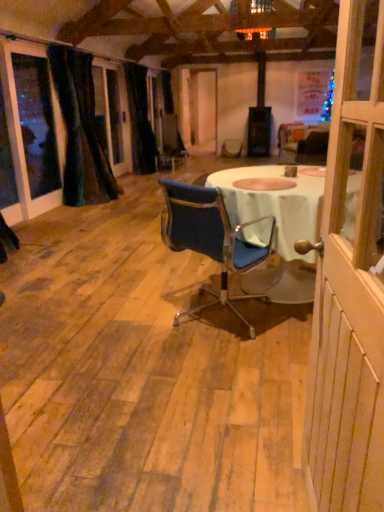
Consider the image. Measure the distance between blue fabric chair at center and camera.

The depth of blue fabric chair at center is 2.10 meters.

Locate an element on the screen. This screenshot has height=512, width=384. black velvet curtain at left, which is counted as the 2th curtain, starting from the front is located at coordinates (140, 120).

Locate an element on the screen. blue fabric chair at center is located at coordinates (x=210, y=239).

Where is `the 1st curtain positioned above the blue fabric chair at center (from a real-world perspective)`? the 1st curtain positioned above the blue fabric chair at center (from a real-world perspective) is located at coordinates (140, 120).

Is point (202, 248) more distant than point (133, 76)?

No.

Is blue fabric chair at center beside black velvet curtain at left, arranged as the 1th curtain when viewed from the back?

They are not placed beside each other.

Can you tell me how much blue fabric chair at center and black velvet curtain at left, arranged as the 1th curtain when viewed from the back, differ in facing direction?

The angle between the facing direction of blue fabric chair at center and the facing direction of black velvet curtain at left, arranged as the 1th curtain when viewed from the back, is 51.1 degrees.

Considering the positions of objects white wood screen door at right and velvet dark green curtain at left, placed as the 1th curtain when sorted from front to back, in the image provided, who is more to the right, white wood screen door at right or velvet dark green curtain at left, placed as the 1th curtain when sorted from front to back,?

From the viewer's perspective, white wood screen door at right appears more on the right side.

Could velvet dark green curtain at left, which appears as the second curtain when viewed from the back, be considered to be inside white wood screen door at right?

No, velvet dark green curtain at left, which appears as the second curtain when viewed from the back, is not inside white wood screen door at right.

Considering the sizes of objects white wood screen door at right and velvet dark green curtain at left, which appears as the second curtain when viewed from the back, in the image provided, who is smaller, white wood screen door at right or velvet dark green curtain at left, which appears as the second curtain when viewed from the back,?

white wood screen door at right.

Is white wood screen door at right wider than velvet dark green curtain at left, which appears as the second curtain when viewed from the back?

No.

Is black velvet curtain at left, arranged as the 1th curtain when viewed from the back, far away from blue fabric chair at center?

black velvet curtain at left, arranged as the 1th curtain when viewed from the back, is positioned a significant distance from blue fabric chair at center.

From the image's perspective, is black velvet curtain at left, arranged as the 1th curtain when viewed from the back, located beneath blue fabric chair at center?

Actually, black velvet curtain at left, arranged as the 1th curtain when viewed from the back, appears above blue fabric chair at center in the image.

Looking at this image, is black velvet curtain at left, arranged as the 1th curtain when viewed from the back, aimed at blue fabric chair at center?

No.

Identify the location of the 2nd curtain behind when counting from the blue fabric chair at center. This screenshot has height=512, width=384. point(140,120).

Starting from the blue fabric chair at center, which curtain is the 1st one behind? Please provide its 2D coordinates.

[(81, 130)]

Which object is positioned more to the left, blue fabric chair at center or velvet dark green curtain at left, placed as the 1th curtain when sorted from front to back?

Positioned to the left is velvet dark green curtain at left, placed as the 1th curtain when sorted from front to back.

Between blue fabric chair at center and velvet dark green curtain at left, placed as the 1th curtain when sorted from front to back, which one is positioned in front?

blue fabric chair at center is in front.

In the scene shown: Does blue fabric chair at center have a lesser width compared to velvet dark green curtain at left, placed as the 1th curtain when sorted from front to back?

Incorrect, the width of blue fabric chair at center is not less than that of velvet dark green curtain at left, placed as the 1th curtain when sorted from front to back.

The height and width of the screenshot is (512, 384). In the image, there is a white wood screen door at right. In order to click on chair above it (from the image's perspective) in this screenshot , I will do `click(210, 239)`.

Can you confirm if white wood screen door at right is thinner than blue fabric chair at center?

Indeed, white wood screen door at right has a lesser width compared to blue fabric chair at center.

Is white wood screen door at right facing away from blue fabric chair at center?

No, white wood screen door at right is not facing the opposite direction of blue fabric chair at center.

I want to click on screen door above the blue fabric chair at center (from a real-world perspective), so click(x=350, y=282).

Who is taller, blue fabric chair at center or white wood screen door at right?

With more height is white wood screen door at right.

Is blue fabric chair at center smaller than white wood screen door at right?

Incorrect, blue fabric chair at center is not smaller in size than white wood screen door at right.

Does point (259, 248) appear closer or farther from the camera than point (327, 276)?

Clearly, point (259, 248) is more distant from the camera than point (327, 276).

Which is more to the left, velvet dark green curtain at left, placed as the 1th curtain when sorted from front to back, or white wood screen door at right?

From the viewer's perspective, velvet dark green curtain at left, placed as the 1th curtain when sorted from front to back, appears more on the left side.

Measure the distance between velvet dark green curtain at left, which appears as the second curtain when viewed from the back, and white wood screen door at right.

A distance of 4.51 meters exists between velvet dark green curtain at left, which appears as the second curtain when viewed from the back, and white wood screen door at right.

Is velvet dark green curtain at left, placed as the 1th curtain when sorted from front to back, aimed at white wood screen door at right?

No.

Where is `the 1st curtain behind the white wood screen door at right`? This screenshot has width=384, height=512. the 1st curtain behind the white wood screen door at right is located at coordinates tap(81, 130).

Locate an element on the screen. This screenshot has width=384, height=512. chair that is in front of the black velvet curtain at left, arranged as the 1th curtain when viewed from the back is located at coordinates (210, 239).

Where is `screen door below the velvet dark green curtain at left, which appears as the second curtain when viewed from the back (from the image's perspective)`? screen door below the velvet dark green curtain at left, which appears as the second curtain when viewed from the back (from the image's perspective) is located at coordinates (350, 282).

Based on their spatial positions, is blue fabric chair at center or velvet dark green curtain at left, placed as the 1th curtain when sorted from front to back, further from black velvet curtain at left, which is counted as the 2th curtain, starting from the front?

blue fabric chair at center is further to black velvet curtain at left, which is counted as the 2th curtain, starting from the front.

Based on their spatial positions, is black velvet curtain at left, which is counted as the 2th curtain, starting from the front, or blue fabric chair at center further from velvet dark green curtain at left, placed as the 1th curtain when sorted from front to back?

blue fabric chair at center.

In the scene shown: Estimate the real-world distances between objects in this image. Which object is further from white wood screen door at right, blue fabric chair at center or velvet dark green curtain at left, placed as the 1th curtain when sorted from front to back?

Among the two, velvet dark green curtain at left, placed as the 1th curtain when sorted from front to back, is located further to white wood screen door at right.

From the image, which object appears to be farther from blue fabric chair at center, white wood screen door at right or black velvet curtain at left, arranged as the 1th curtain when viewed from the back?

black velvet curtain at left, arranged as the 1th curtain when viewed from the back, lies further to blue fabric chair at center than the other object.

Based on the photo, considering their positions, is blue fabric chair at center positioned further to velvet dark green curtain at left, which appears as the second curtain when viewed from the back, than white wood screen door at right?

white wood screen door at right lies further to velvet dark green curtain at left, which appears as the second curtain when viewed from the back, than the other object.

Based on their spatial positions, is black velvet curtain at left, which is counted as the 2th curtain, starting from the front, or white wood screen door at right further from blue fabric chair at center?

black velvet curtain at left, which is counted as the 2th curtain, starting from the front, lies further to blue fabric chair at center than the other object.

From the image, which object appears to be farther from black velvet curtain at left, which is counted as the 2th curtain, starting from the front, white wood screen door at right or blue fabric chair at center?

white wood screen door at right.

Which object lies nearer to the anchor point white wood screen door at right, black velvet curtain at left, which is counted as the 2th curtain, starting from the front, or velvet dark green curtain at left, which appears as the second curtain when viewed from the back?

Among the two, velvet dark green curtain at left, which appears as the second curtain when viewed from the back, is located nearer to white wood screen door at right.

Where is `curtain located between white wood screen door at right and black velvet curtain at left, which is counted as the 2th curtain, starting from the front, in the depth direction`? This screenshot has width=384, height=512. curtain located between white wood screen door at right and black velvet curtain at left, which is counted as the 2th curtain, starting from the front, in the depth direction is located at coordinates (81, 130).

This screenshot has width=384, height=512. Find the location of `curtain located between blue fabric chair at center and black velvet curtain at left, arranged as the 1th curtain when viewed from the back, in the depth direction`. curtain located between blue fabric chair at center and black velvet curtain at left, arranged as the 1th curtain when viewed from the back, in the depth direction is located at coordinates (81, 130).

The image size is (384, 512). What are the coordinates of `chair positioned between white wood screen door at right and velvet dark green curtain at left, which appears as the second curtain when viewed from the back, from near to far` in the screenshot? It's located at (210, 239).

In order to click on chair between white wood screen door at right and black velvet curtain at left, which is counted as the 2th curtain, starting from the front, in the front-back direction in this screenshot , I will do `click(210, 239)`.